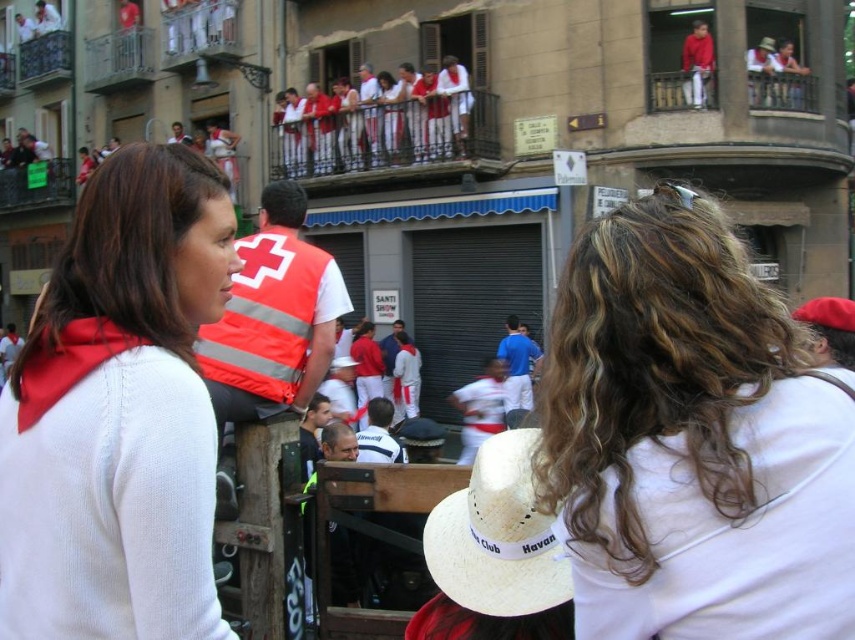
From the picture: You are a photographer trying to capture a clear shot of both the white wavy hair at center and the straw hat at center. Based on their positions, which object should you focus on first to ensure both are in frame?

The white wavy hair at center is located above the straw hat at center, so focusing on the white wavy hair at center first will ensure both are in frame as the straw hat at center is below it.

You are an artist trying to sketch the scene. You notice the white wavy hair at center and the white matte sweater at upper left. Which object should you draw first if you want to follow the rule of drawing closer objects before distant ones?

The white wavy hair at center should be drawn first because it has a lesser height compared to the white matte sweater at upper left, indicating it is closer to the viewer.

You are a photographer trying to capture a candid shot of the two people in the center of the scene. The white wavy hair at center and the white straw cowboy hat at upper center are your subjects. Based on their positions, which subject is closer to the left side of the frame?

The white wavy hair at center is to the left of the white straw cowboy hat at upper center, so the white wavy hair at center is closer to the left side of the frame.